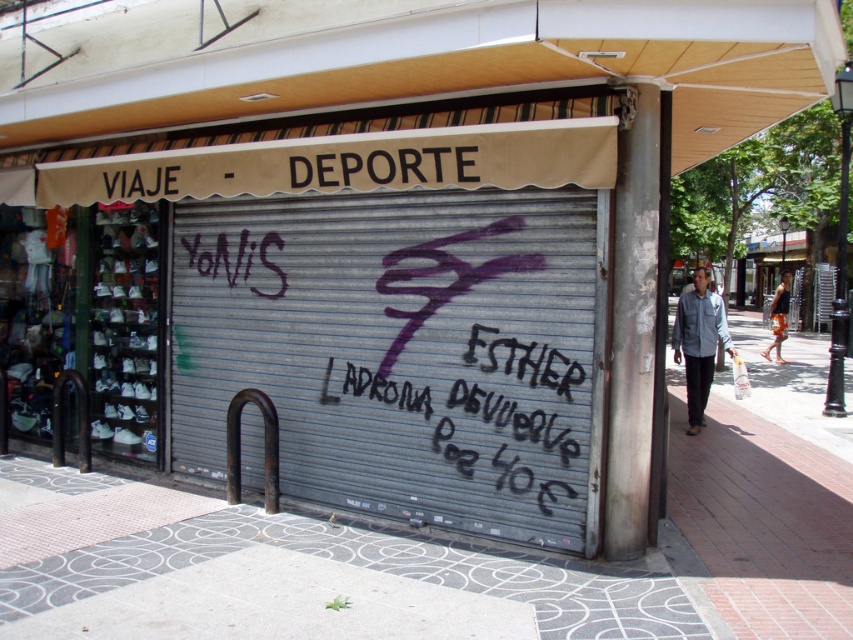
Please provide the 2D coordinates of the metallic gray garage door at center in the image. The coordinates should be in the format of a tuple with two decimal numbers between 0 and 1, where 0 represents the bottom left corner and 1 represents the top right corner of the image.

The 2D coordinates of the metallic gray garage door at center are at point (x=398, y=349).